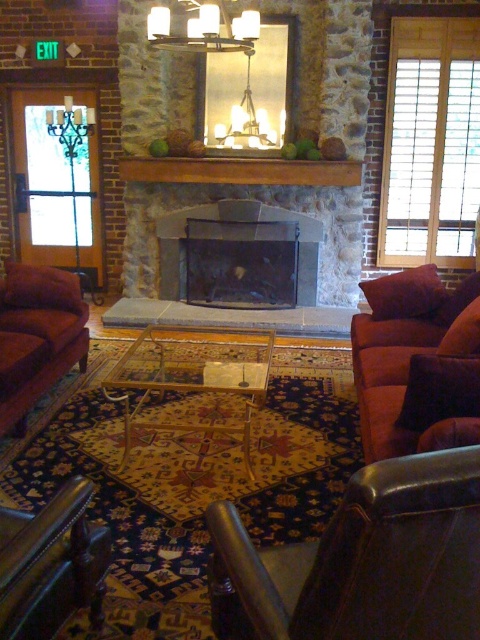
Which of these two, leather armchair at lower left or matte white fixture at upper center, stands shorter?

leather armchair at lower left

You are a GUI agent. You are given a task and a screenshot of the screen. Output one action in this format:
    pyautogui.click(x=<x>, y=<y>)
    Task: Click on the leather armchair at lower left
    The height and width of the screenshot is (640, 480).
    Given the screenshot: What is the action you would take?
    pyautogui.click(x=50, y=564)

Who is more distant from viewer, (96, 572) or (167, 13)?

The point (167, 13) is more distant.

The height and width of the screenshot is (640, 480). Find the location of `leather armchair at lower left`. leather armchair at lower left is located at coordinates (50, 564).

Does leather at lower right have a lesser height compared to clear glass coffee table at center?

Yes, leather at lower right is shorter than clear glass coffee table at center.

Where is `leather at lower right`? The width and height of the screenshot is (480, 640). leather at lower right is located at coordinates coord(363,561).

Does velvet brown couch at right come behind dark gray stone fireplace at center?

No, it is in front of dark gray stone fireplace at center.

Does velvet brown couch at right lie in front of dark gray stone fireplace at center?

That is True.

The width and height of the screenshot is (480, 640). What are the coordinates of `velvet brown couch at right` in the screenshot? It's located at (417, 364).